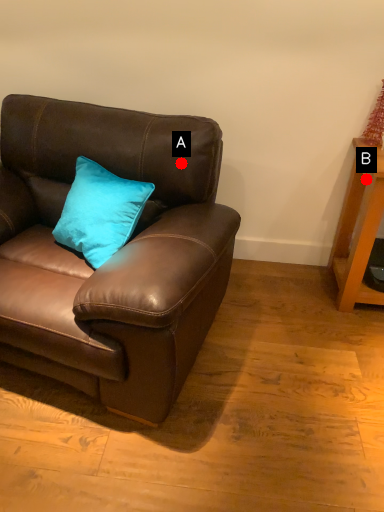
Question: Two points are circled on the image, labeled by A and B beside each circle. Which point is further to the camera?

Choices:
 (A) A is further
 (B) B is further

Answer: (B)